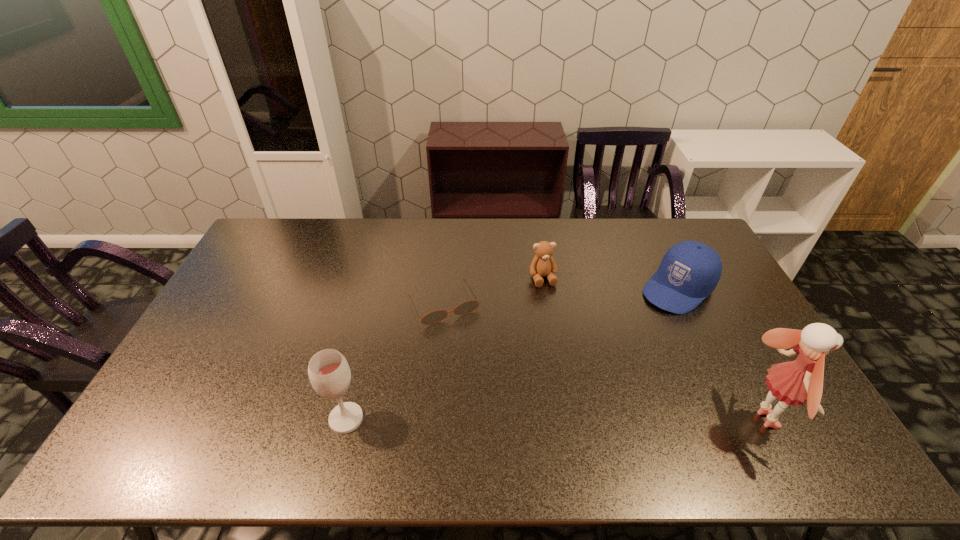
At what (x,y) coordinates should I click in order to perform the action: click on free space located on the face of the shortest object. Please return your answer as a coordinate pair (x, y). This screenshot has width=960, height=540. Looking at the image, I should click on (482, 376).

This screenshot has width=960, height=540. Identify the location of free region located 0.280m on the face of the shortest object. (494, 399).

You are a GUI agent. You are given a task and a screenshot of the screen. Output one action in this format:
    pyautogui.click(x=<x>, y=<y>)
    Task: Click on the free space located on the front-facing side of the cap
    
    Given the screenshot: What is the action you would take?
    pyautogui.click(x=603, y=351)

Find the location of a particular element. vacant space located on the front-facing side of the cap is located at coordinates (642, 318).

This screenshot has height=540, width=960. What are the coordinates of `vacant space positioned on the front-facing side of the cap` in the screenshot? It's located at (612, 344).

Where is `vacant region located 0.170m on the face of the teddy bear`? vacant region located 0.170m on the face of the teddy bear is located at coordinates (559, 326).

Identify the location of vacant space located 0.290m on the face of the teddy bear. (570, 357).

You are a GUI agent. You are given a task and a screenshot of the screen. Output one action in this format:
    pyautogui.click(x=<x>, y=<y>)
    Task: Click on the free space located 0.150m on the face of the teddy bear
    
    Given the screenshot: What is the action you would take?
    pyautogui.click(x=558, y=321)

What are the coordinates of `wineglass that is at the near edge` in the screenshot? It's located at (329, 373).

Find the location of a particular element. The height and width of the screenshot is (540, 960). doll positioned at the near edge is located at coordinates (795, 382).